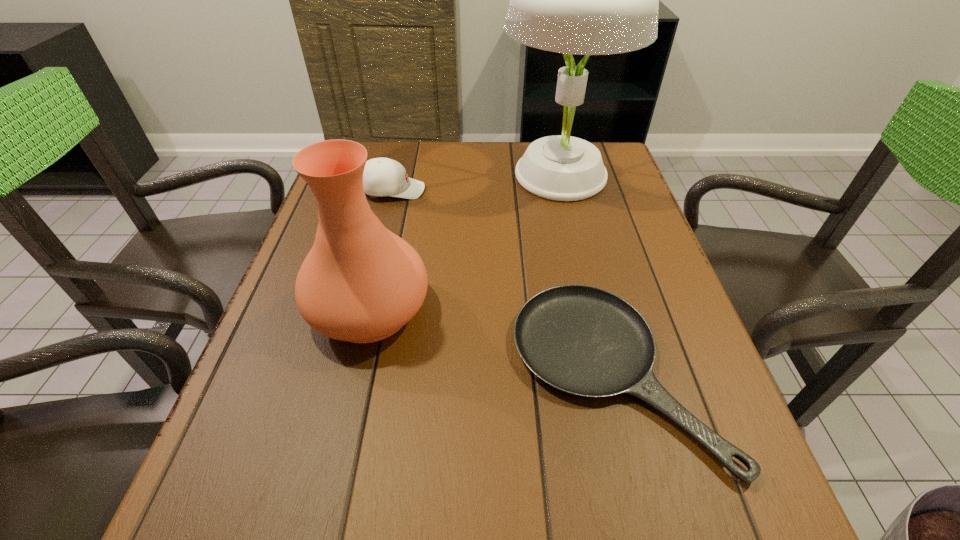
Find the location of a particular element. Image resolution: width=960 pixels, height=540 pixels. vacant space that satisfies the following two spatial constraints: 1. on the front-facing side of the baseball cap; 2. on the left side of the frying pan is located at coordinates pyautogui.click(x=347, y=373).